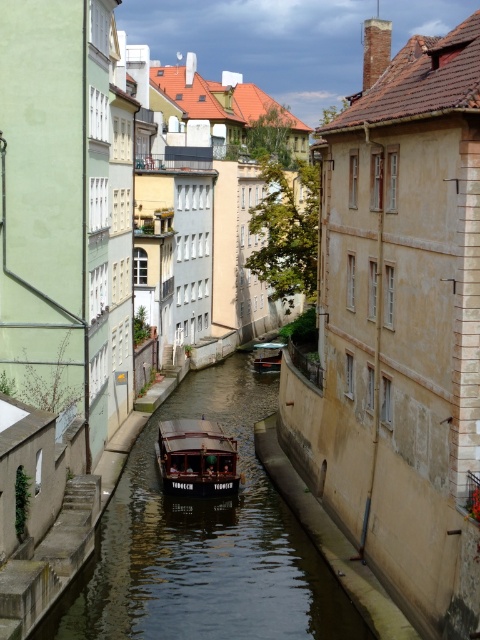
Can you confirm if smooth dark water at center is wider than wooden boat at center?

Indeed, smooth dark water at center has a greater width compared to wooden boat at center.

Between point (282, 636) and point (194, 460), which one is positioned behind?

The point (194, 460) is behind.

Where is `smooth dark water at center`? This screenshot has height=640, width=480. smooth dark water at center is located at coordinates (204, 545).

Between smooth dark water at center and wooden polished boat at center, which one has more height?

Standing taller between the two is smooth dark water at center.

Does point (66, 593) come closer to viewer compared to point (280, 355)?

Yes, it is.

The image size is (480, 640). What do you see at coordinates (204, 545) in the screenshot?
I see `smooth dark water at center` at bounding box center [204, 545].

The height and width of the screenshot is (640, 480). Find the location of `smooth dark water at center`. smooth dark water at center is located at coordinates (204, 545).

Is wooden boat at center thinner than wooden polished boat at center?

In fact, wooden boat at center might be wider than wooden polished boat at center.

Can you confirm if wooden boat at center is shorter than wooden polished boat at center?

In fact, wooden boat at center may be taller than wooden polished boat at center.

The image size is (480, 640). I want to click on wooden boat at center, so click(196, 458).

Identify the location of wooden boat at center. (196, 458).